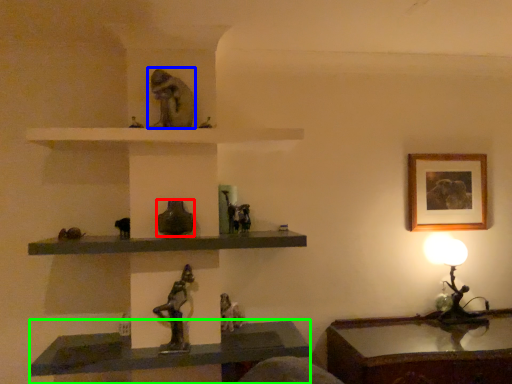
Question: Estimate the real-world distances between objects in this image. Which object is farther from glass vase (highlighted by a red box), animal (highlighted by a blue box) or vanity (highlighted by a green box)?

Choices:
 (A) animal
 (B) vanity

Answer: (B)